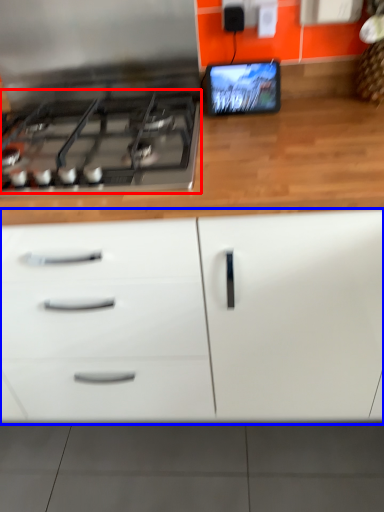
Question: Which object is further to the camera taking this photo, gas stove (highlighted by a red box) or cabinetry (highlighted by a blue box)?

Choices:
 (A) gas stove
 (B) cabinetry

Answer: (A)